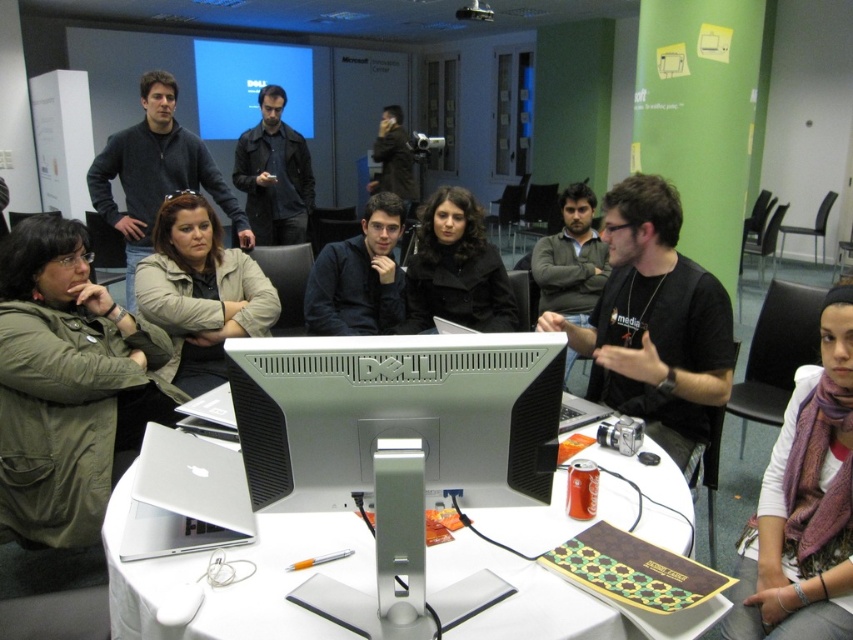
Is black matte shirt at center to the left of dark brown leather jacket at center from the viewer's perspective?

No, black matte shirt at center is not to the left of dark brown leather jacket at center.

How distant is black matte shirt at center from dark brown leather jacket at center?

black matte shirt at center and dark brown leather jacket at center are 4.64 meters apart.

The height and width of the screenshot is (640, 853). I want to click on black matte shirt at center, so click(x=654, y=323).

Image resolution: width=853 pixels, height=640 pixels. Find the location of `black matte shirt at center`. black matte shirt at center is located at coordinates (654, 323).

Can you confirm if purple scarf at lower right is thinner than dark blue shirt at center?

Indeed, purple scarf at lower right has a lesser width compared to dark blue shirt at center.

Does point (793, 486) come in front of point (276, 205)?

Yes, it is.

Locate an element on the screen. purple scarf at lower right is located at coordinates (804, 502).

Locate an element on the screen. The width and height of the screenshot is (853, 640). purple scarf at lower right is located at coordinates (804, 502).

Which is below, silver metallic monitor at center or purple scarf at lower right?

purple scarf at lower right is below.

Is silver metallic monitor at center below purple scarf at lower right?

Incorrect, silver metallic monitor at center is not positioned below purple scarf at lower right.

Is point (326, 486) positioned after point (821, 624)?

No, it is in front of (821, 624).

Image resolution: width=853 pixels, height=640 pixels. What are the coordinates of `silver metallic monitor at center` in the screenshot? It's located at (396, 416).